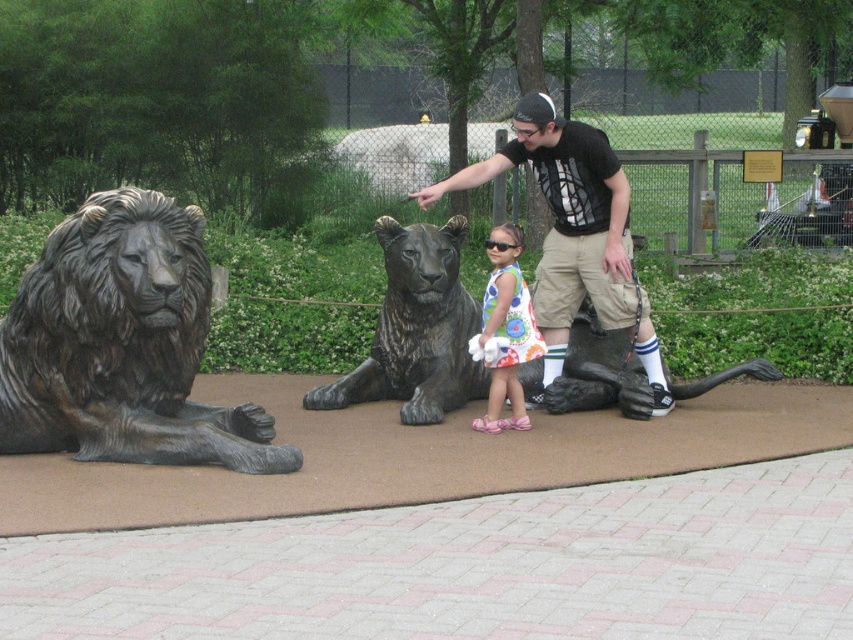
Question: Can you confirm if bronze lion at left is thinner than floral dress at center?

Choices:
 (A) no
 (B) yes

Answer: (A)

Question: Is bronze statue of a lion at center to the left of black t-shirt at center from the viewer's perspective?

Choices:
 (A) no
 (B) yes

Answer: (B)

Question: Which point is farther to the camera?

Choices:
 (A) (550, 195)
 (B) (436, 262)
 (C) (527, 317)

Answer: (B)

Question: Based on their relative distances, which object is nearer to the black t-shirt at center?

Choices:
 (A) floral dress at center
 (B) bronze statue of a lion at center

Answer: (B)

Question: Which object appears closest to the camera in this image?

Choices:
 (A) bronze statue of a lion at center
 (B) black t-shirt at center
 (C) bronze lion at left
 (D) floral dress at center

Answer: (C)

Question: Does bronze statue of a lion at center have a larger size compared to black t-shirt at center?

Choices:
 (A) yes
 (B) no

Answer: (A)